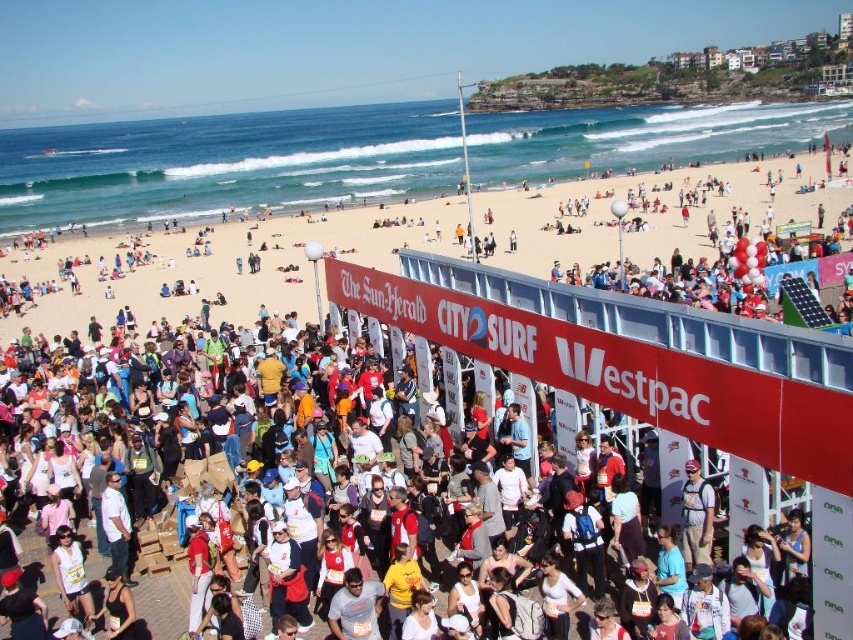
Does white cotton crowd at center lie behind white sand beach at upper center?

No, white cotton crowd at center is in front of white sand beach at upper center.

Can you confirm if white cotton crowd at center is positioned below white sand beach at upper center?

Indeed, white cotton crowd at center is positioned under white sand beach at upper center.

Describe the element at coordinates (210, 481) in the screenshot. I see `white cotton crowd at center` at that location.

Identify the location of white cotton crowd at center. (210, 481).